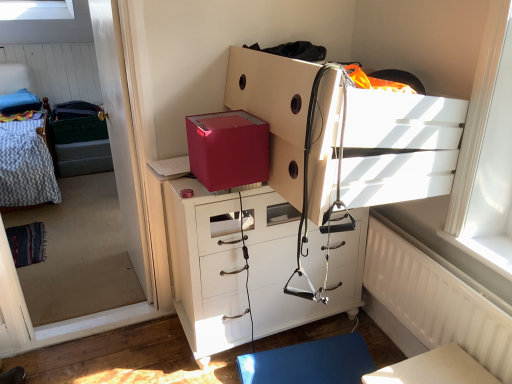
This screenshot has height=384, width=512. Find the location of `vacant space behind transparent glass window screen at left`. vacant space behind transparent glass window screen at left is located at coordinates (97, 293).